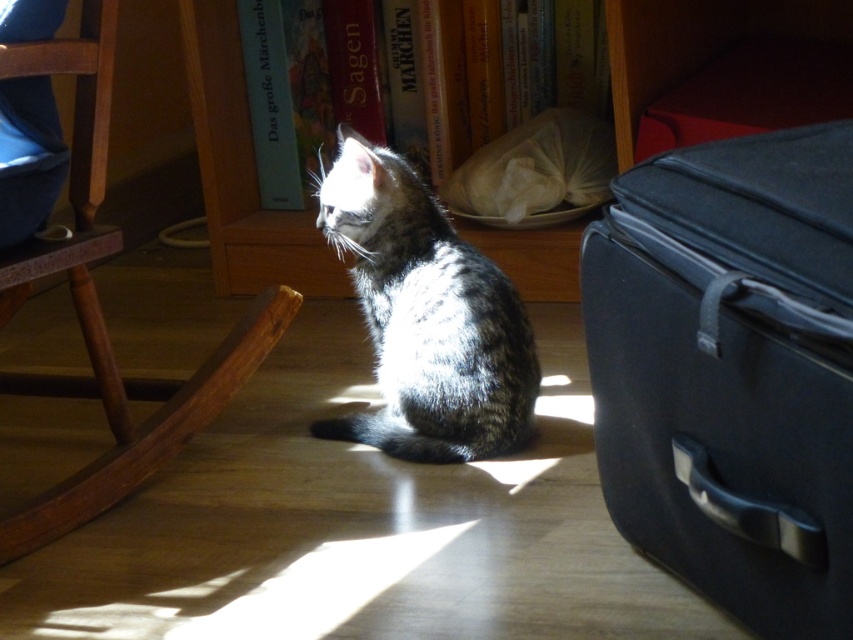
You are a photographer standing at the camera position. You want to take a closeup shot of the matte black suitcase at right without moving the camera. Can you reach it with your hand?

The matte black suitcase at right is 28.09 inches away from camera, so yes, you can reach it with your hand since it is within arm reach.

You are a guest in this room and want to place your suitcase near the wooden rocking chair at left without blocking the path to the bookshelf. Can you place the matte black suitcase at right there?

The matte black suitcase at right is already positioned to the right of the wooden rocking chair at left. If you move it to the left side of the rocking chair, it might block the path to the bookshelf behind the kitten. Please ensure there is enough space when relocating it.